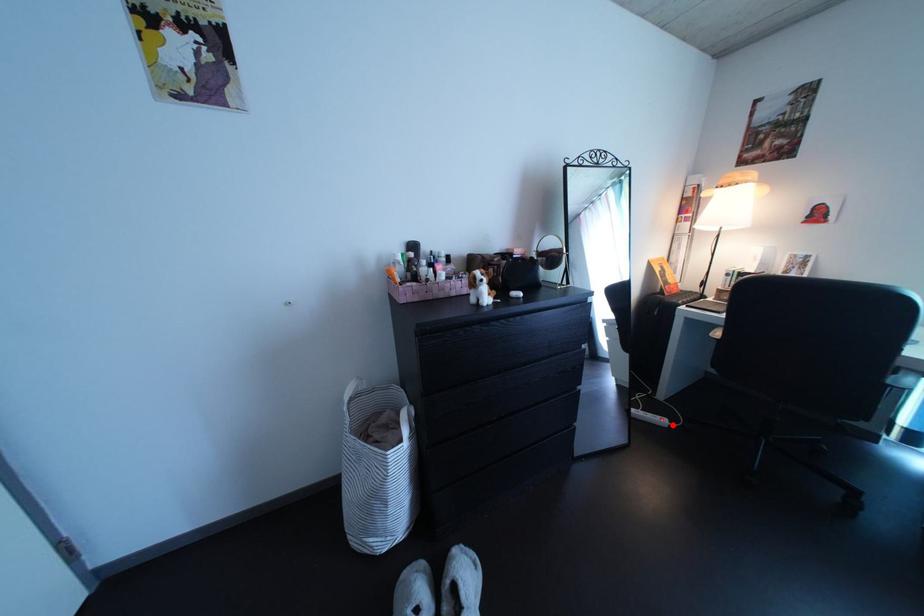
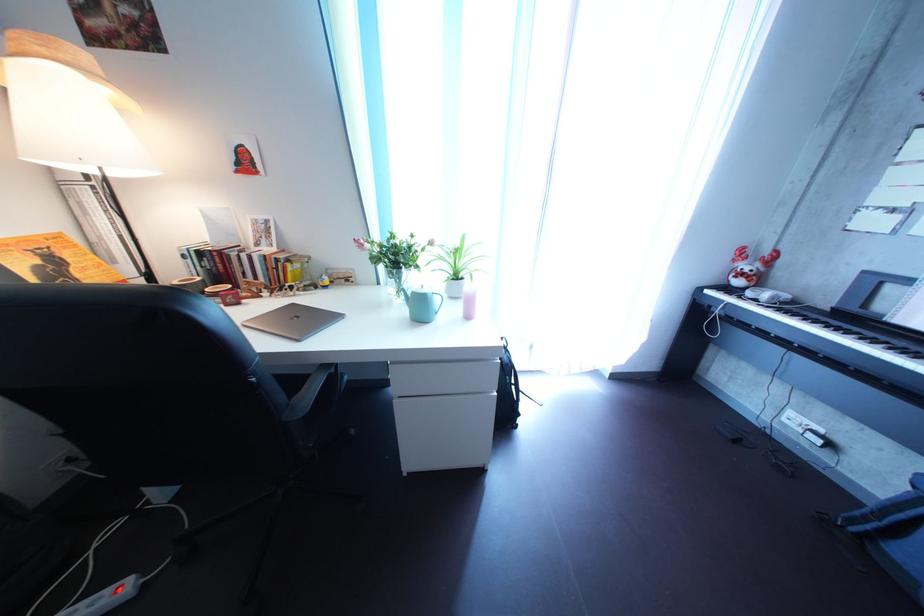
Find the pixel in the second image that matches the highlighted location in the first image.

(122, 601)